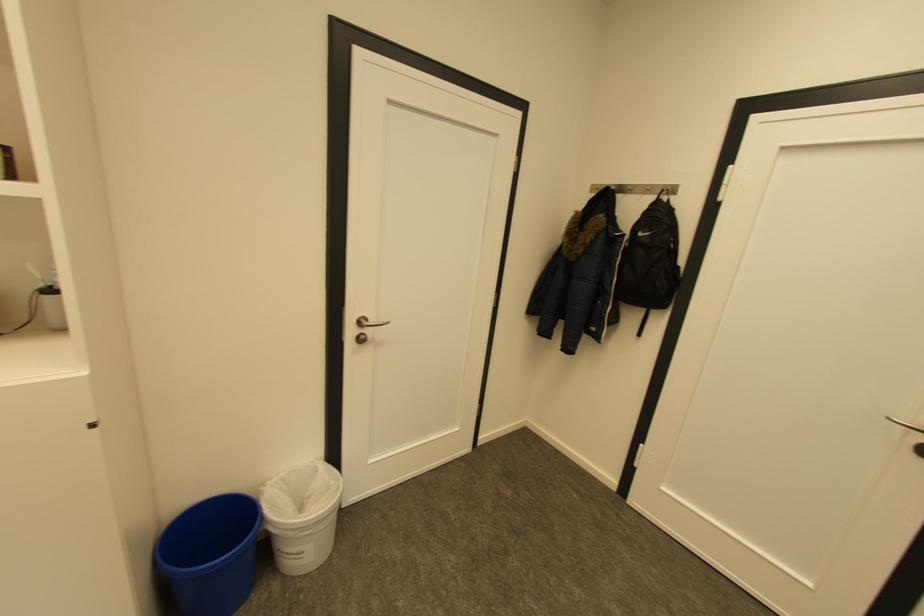
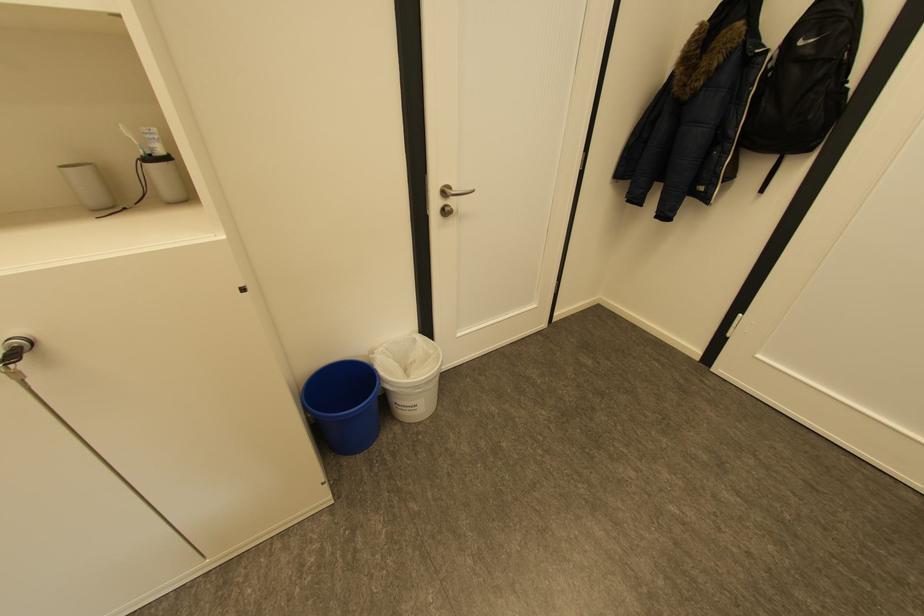
Question: I am providing you with two images of the same scene from different viewpoints. Please identify which objects are invisible in image2.

Choices:
 (A) white trash can
 (B) grey cup
 (C) toothbrush holder
 (D) none of these

Answer: (D)